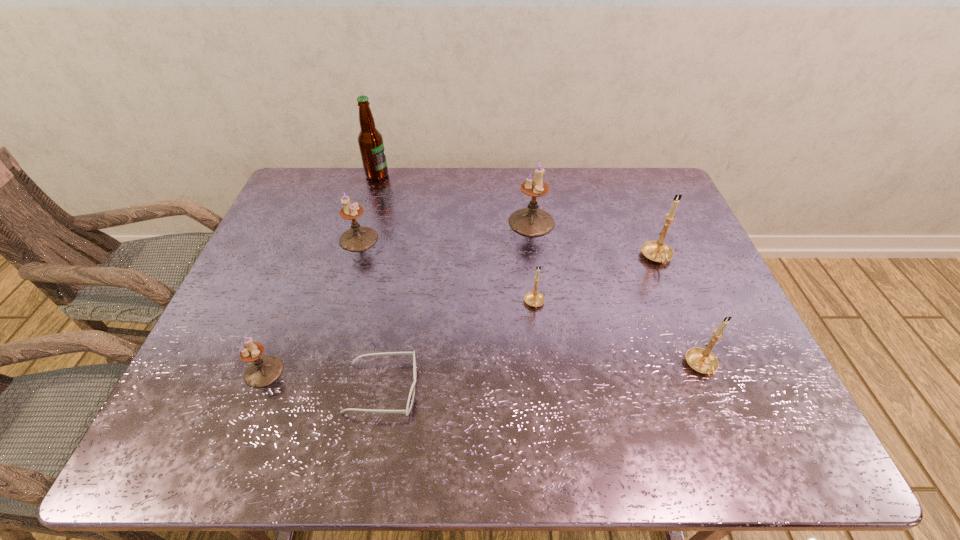
Identify which candle holder is located as the fourth nearest to the farthest gold candle holder. Please provide its 2D coordinates. Your answer should be formatted as a tuple, i.e. [(x, y)], where the tuple contains the x and y coordinates of a point satisfying the conditions above.

[(358, 238)]

Identify which candle holder is located as the sixth nearest to the tallest object. Please provide its 2D coordinates. Your answer should be formatted as a tuple, i.e. [(x, y)], where the tuple contains the x and y coordinates of a point satisfying the conditions above.

[(701, 360)]

Identify which gold candle holder is located as the nearest to the rightmost purple candle holder. Please provide its 2D coordinates. Your answer should be formatted as a tuple, i.e. [(x, y)], where the tuple contains the x and y coordinates of a point satisfying the conditions above.

[(534, 298)]

The height and width of the screenshot is (540, 960). Find the location of `gold candle holder that can be found as the closest to the nearest gold candle holder`. gold candle holder that can be found as the closest to the nearest gold candle holder is located at coordinates (657, 251).

Find the location of a particular element. The image size is (960, 540). purple candle holder that stands as the second closest to the farthest gold candle holder is located at coordinates (358, 238).

I want to click on purple candle holder that is the closest one to the second purple candle holder from left to right, so click(263, 371).

This screenshot has width=960, height=540. In order to click on vacant region that satisfies the following two spatial constraints: 1. on the back side of the smallest purple candle holder; 2. on the left side of the biggest purple candle holder in this screenshot , I will do `click(323, 222)`.

Find the location of a particular element. The width and height of the screenshot is (960, 540). free space that satisfies the following two spatial constraints: 1. on the label of the farthest object; 2. on the back side of the biggest purple candle holder is located at coordinates (363, 222).